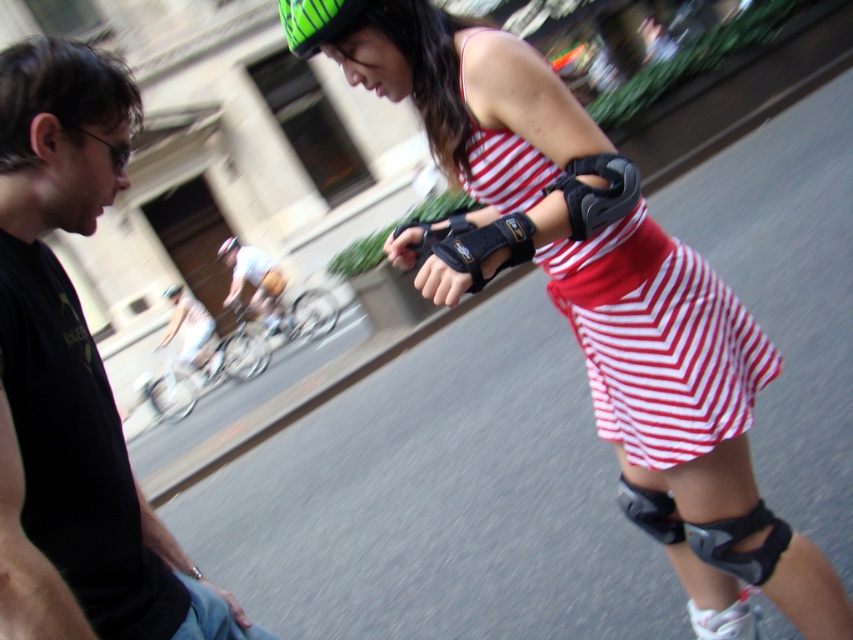
Can you confirm if black matte knee pad at lower center is taller than green matte helmet at upper center?

No, black matte knee pad at lower center is not taller than green matte helmet at upper center.

Is black matte knee pad at lower center thinner than green matte helmet at upper center?

Correct, black matte knee pad at lower center's width is less than green matte helmet at upper center's.

Who is more distant from viewer, (654, 531) or (233, 244)?

Point (233, 244)

Identify the location of black matte knee pad at lower center. The height and width of the screenshot is (640, 853). (648, 512).

Which is behind, point (309, 36) or point (657, 508)?

Point (657, 508)

Which is below, green striped helmet at upper center or black matte knee pad at lower center?

→ black matte knee pad at lower center is lower down.

Describe the element at coordinates (316, 20) in the screenshot. I see `green striped helmet at upper center` at that location.

Where is `green striped helmet at upper center`? The image size is (853, 640). green striped helmet at upper center is located at coordinates (316, 20).

Between black matte t-shirt at left and green striped helmet at upper center, which one has more height?

black matte t-shirt at left is taller.

Between point (74, 173) and point (280, 12), which one is positioned in front?

Positioned in front is point (74, 173).

The width and height of the screenshot is (853, 640). What are the coordinates of `black matte t-shirt at left` in the screenshot? It's located at (74, 380).